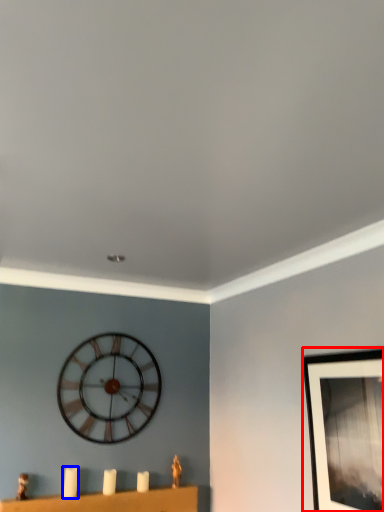
Question: Among these objects, which one is farthest to the camera, picture frame (highlighted by a red box) or candle (highlighted by a blue box)?

Choices:
 (A) picture frame
 (B) candle

Answer: (B)